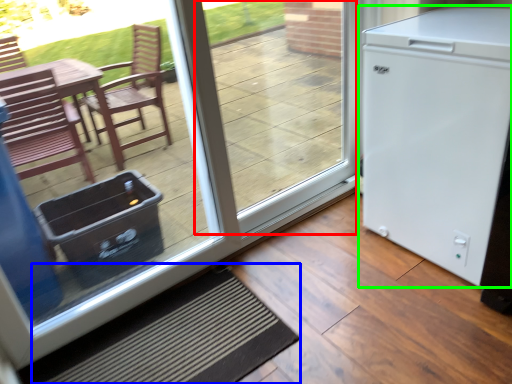
Question: Based on their relative distances, which object is nearer to window (highlighted by a red box)? Choose from doormat (highlighted by a blue box) and refrigerator (highlighted by a green box).

Choices:
 (A) doormat
 (B) refrigerator

Answer: (B)